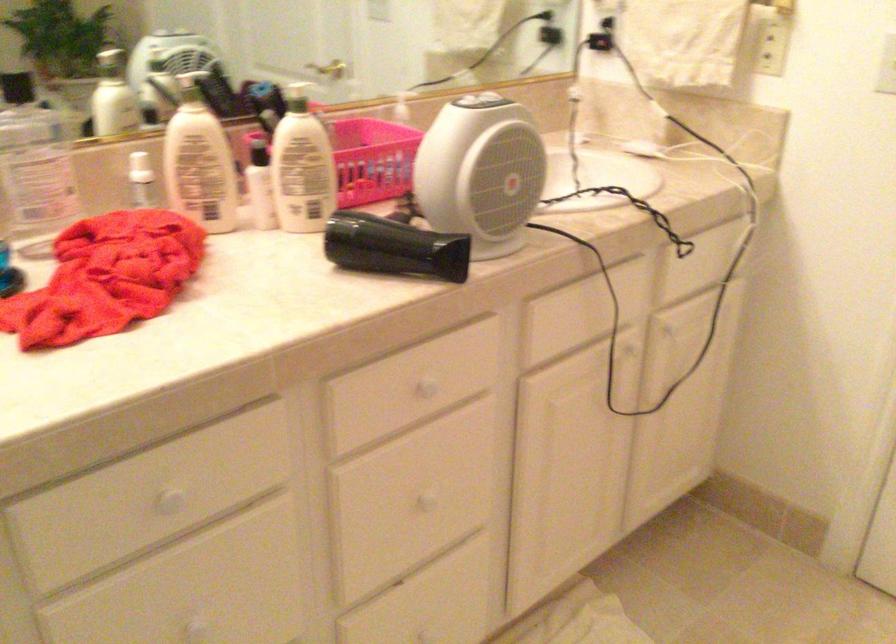
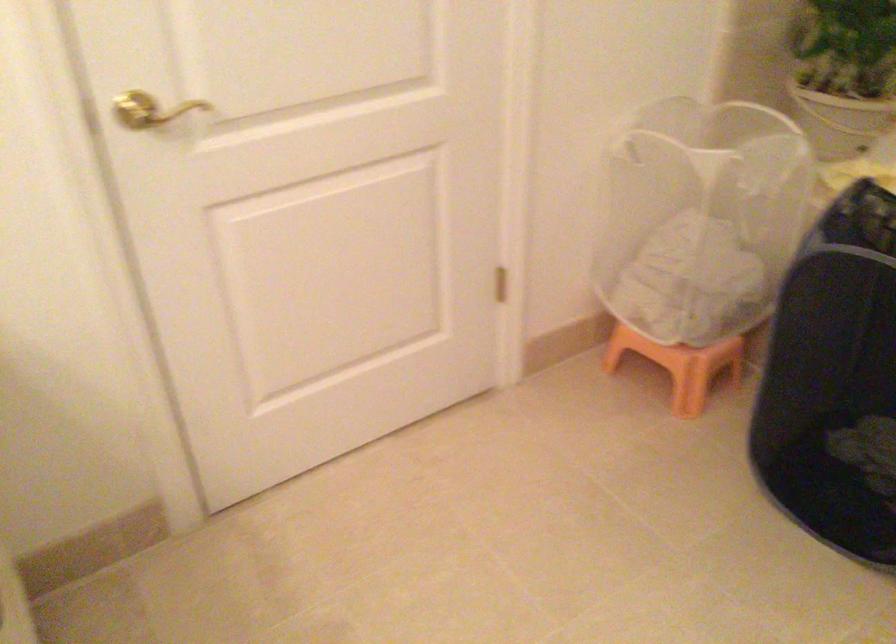
Based on the continuous images, in which direction is the camera rotating?

The camera's rotation is toward right-down.